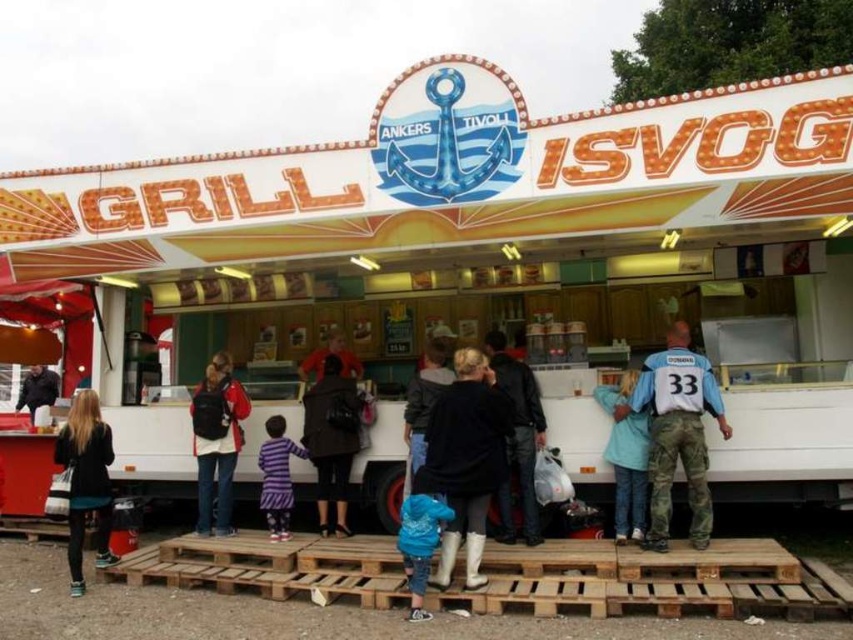
You are a vendor at the GRILL ISVOG stall and need to store two items in a narrow drawer. You have a black matte jacket at center and a white jersey at center. Which item can fit better in the drawer if the drawer has limited width?

The black matte jacket at center is thinner than the white jersey at center, so it can fit better in the narrow drawer.

You are a photographer at the fairground. You need to take a photo of both the black matte jacket at center and the white jersey at center. Which one should you focus on first if you want to capture the larger item in the frame?

The black matte jacket at center is bigger than the white jersey at center, so you should focus on the black matte jacket at center first to capture the larger item in the frame.